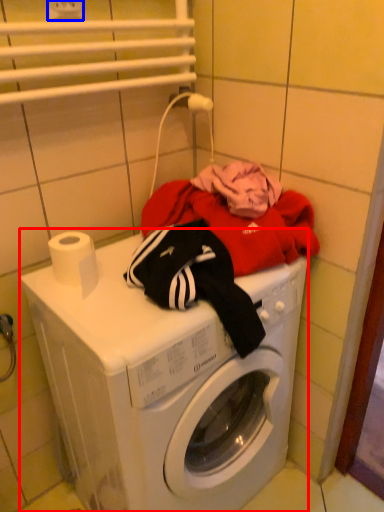
Question: Which object is closer to the camera taking this photo, washing machine (highlighted by a red box) or electric outlet (highlighted by a blue box)?

Choices:
 (A) washing machine
 (B) electric outlet

Answer: (A)